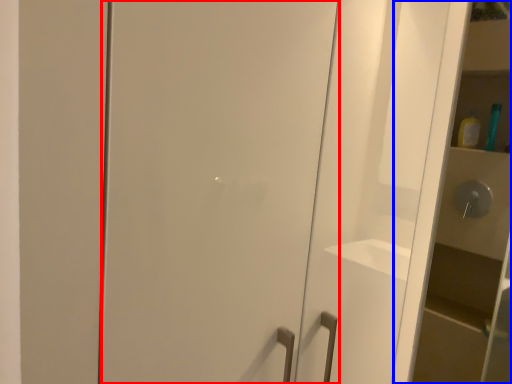
Question: Which object is closer to the camera taking this photo, door (highlighted by a red box) or cabinetry (highlighted by a blue box)?

Choices:
 (A) door
 (B) cabinetry

Answer: (A)